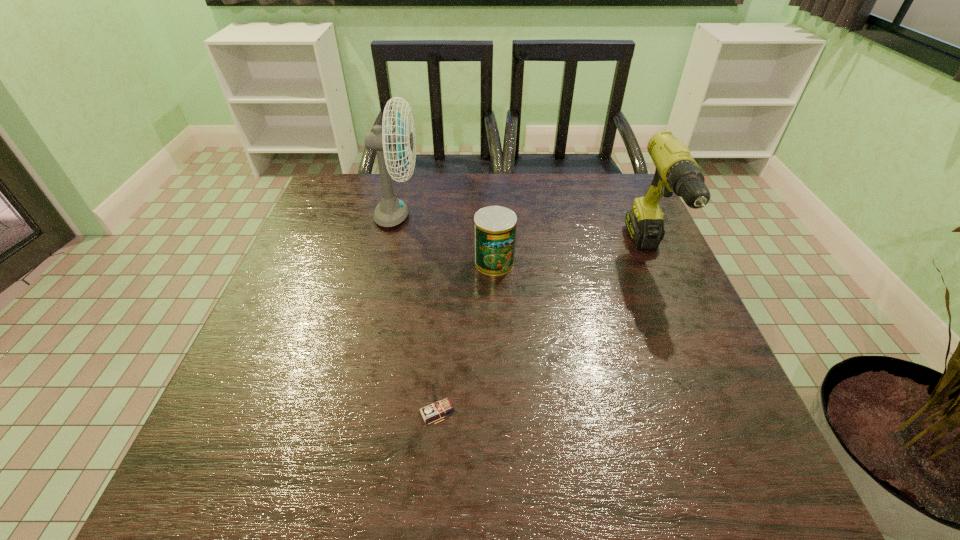
Identify the location of empty location between the shortest object and the leftmost object. The width and height of the screenshot is (960, 540). (418, 315).

The width and height of the screenshot is (960, 540). In order to click on vacant space that is in between the fan and the drill in this screenshot , I will do `click(523, 237)`.

Where is `free spot between the nearest object and the leftmost object`? free spot between the nearest object and the leftmost object is located at coordinates (418, 315).

Find the location of `free space between the fan and the can`. free space between the fan and the can is located at coordinates (445, 240).

Find the location of a particular element. free point between the nearest object and the fan is located at coordinates (418, 315).

I want to click on free spot between the third object from left to right and the matchbox, so click(x=466, y=337).

I want to click on free space that is in between the fan and the nearest object, so click(418, 315).

Locate an element on the screen. unoccupied area between the rightmost object and the second object from right to left is located at coordinates (572, 260).

Point out which object is positioned as the second nearest to the leftmost object. Please provide its 2D coordinates. Your answer should be formatted as a tuple, i.e. [(x, y)], where the tuple contains the x and y coordinates of a point satisfying the conditions above.

[(437, 407)]

Select which object appears as the second closest to the fan. Please provide its 2D coordinates. Your answer should be formatted as a tuple, i.e. [(x, y)], where the tuple contains the x and y coordinates of a point satisfying the conditions above.

[(437, 407)]